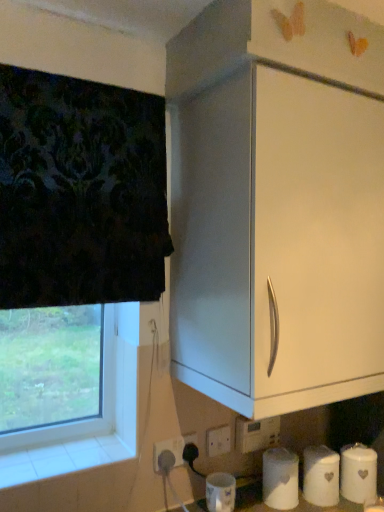
Describe the element at coordinates (169, 451) in the screenshot. I see `white plastic electric outlet at lower center, the 3th electric outlet when ordered from right to left` at that location.

The width and height of the screenshot is (384, 512). I want to click on white matte cabinet at upper right, so click(x=277, y=205).

How much space does white plastic electric outlet at lower center, the third electric outlet positioned from the left, occupy vertically?

3.48 inches.

What do you see at coordinates (190, 449) in the screenshot? The width and height of the screenshot is (384, 512). I see `white plastic electric outlet at lower center, the 2th electric outlet in the left-to-right sequence` at bounding box center [190, 449].

You are a GUI agent. You are given a task and a screenshot of the screen. Output one action in this format:
    pyautogui.click(x=<x>, y=<y>)
    Task: Click on the white matte toilet paper at lower center, the 1th toilet paper viewed from the left
    The width and height of the screenshot is (384, 512).
    Given the screenshot: What is the action you would take?
    pyautogui.click(x=280, y=479)

How many degrees apart are the facing directions of white matte paper towel at lower center and white plastic electric outlet at lower center, arranged as the 1th electric outlet when viewed from the right?

white matte paper towel at lower center and white plastic electric outlet at lower center, arranged as the 1th electric outlet when viewed from the right, are facing 1.15 degrees away from each other.

Considering the positions of objects white matte paper towel at lower center and white plastic electric outlet at lower center, arranged as the 1th electric outlet when viewed from the right, in the image provided, who is more to the left, white matte paper towel at lower center or white plastic electric outlet at lower center, arranged as the 1th electric outlet when viewed from the right,?

white matte paper towel at lower center.

Is point (230, 504) positioned behind point (218, 452)?

No, (230, 504) is closer to viewer.

From the picture: From their relative heights in the image, would you say white matte paper towel at lower center is taller or shorter than white plastic electric outlet at lower center, the third electric outlet positioned from the left?

In the image, white matte paper towel at lower center appears to be taller than white plastic electric outlet at lower center, the third electric outlet positioned from the left.

Does white plastic electric outlet at lower center, the 2th electric outlet in the left-to-right sequence, contain white plastic electric outlet at lower center, arranged as the 1th electric outlet when viewed from the right?

No, white plastic electric outlet at lower center, arranged as the 1th electric outlet when viewed from the right, is not a part of white plastic electric outlet at lower center, the 2th electric outlet in the left-to-right sequence.

Is white plastic electric outlet at lower center, the 2th electric outlet in the left-to-right sequence, facing away from white plastic electric outlet at lower center, the third electric outlet positioned from the left?

No, white plastic electric outlet at lower center, the 2th electric outlet in the left-to-right sequence, is not facing the opposite direction of white plastic electric outlet at lower center, the third electric outlet positioned from the left.

Considering the positions of objects white plastic electric outlet at lower center, the 2th electric outlet in the left-to-right sequence, and white plastic electric outlet at lower center, the third electric outlet positioned from the left, in the image provided, who is behind, white plastic electric outlet at lower center, the 2th electric outlet in the left-to-right sequence, or white plastic electric outlet at lower center, the third electric outlet positioned from the left,?

white plastic electric outlet at lower center, the third electric outlet positioned from the left, is more distant.

Considering the positions of points (211, 430) and (265, 504), is point (211, 430) farther from camera compared to point (265, 504)?

Yes, it is.

Between white plastic electric outlet at lower center, arranged as the 1th electric outlet when viewed from the right, and white matte toilet paper at lower center, the 1th toilet paper viewed from the left, which one has more height?

white matte toilet paper at lower center, the 1th toilet paper viewed from the left, is taller.

From a real-world perspective, which is physically above, white plastic electric outlet at lower center, arranged as the 1th electric outlet when viewed from the right, or white matte toilet paper at lower center, the 1th toilet paper viewed from the left?

white plastic electric outlet at lower center, arranged as the 1th electric outlet when viewed from the right, is physically above.

From the image's perspective, between white plastic electric outlet at lower center, arranged as the 1th electric outlet when viewed from the right, and white matte toilet paper at lower center, placed as the third toilet paper when sorted from right to left, who is located below?

white matte toilet paper at lower center, placed as the third toilet paper when sorted from right to left, appears lower in the image.

Is white ceramic canister at lower right, acting as the 1th toilet paper starting from the right, looking in the opposite direction of white matte toilet paper at lower center, placed as the third toilet paper when sorted from right to left?

No, white matte toilet paper at lower center, placed as the third toilet paper when sorted from right to left, is not at the back of white ceramic canister at lower right, acting as the 1th toilet paper starting from the right.

Based on the photo, can you confirm if white ceramic canister at lower right, acting as the 1th toilet paper starting from the right, is bigger than white matte toilet paper at lower center, the 1th toilet paper viewed from the left?

Actually, white ceramic canister at lower right, acting as the 1th toilet paper starting from the right, might be smaller than white matte toilet paper at lower center, the 1th toilet paper viewed from the left.

Is white ceramic canister at lower right, which is the third toilet paper from left to right, located outside white matte toilet paper at lower center, the 1th toilet paper viewed from the left?

Yes, white ceramic canister at lower right, which is the third toilet paper from left to right, is not within white matte toilet paper at lower center, the 1th toilet paper viewed from the left.

Is white matte paper towel at lower center behind white matte canister at lower right, marked as the second toilet paper in a right-to-left arrangement?

No, white matte paper towel at lower center is in front of white matte canister at lower right, marked as the second toilet paper in a right-to-left arrangement.

Does white matte paper towel at lower center have a lesser height compared to white matte canister at lower right, marked as the second toilet paper in a right-to-left arrangement?

Yes, white matte paper towel at lower center is shorter than white matte canister at lower right, marked as the second toilet paper in a right-to-left arrangement.

Looking at this image, in terms of width, does white matte paper towel at lower center look wider or thinner when compared to white matte canister at lower right, marked as the second toilet paper in a right-to-left arrangement?

white matte paper towel at lower center is wider than white matte canister at lower right, marked as the second toilet paper in a right-to-left arrangement.

Does point (235, 494) come behind point (321, 449)?

No, (235, 494) is closer to viewer.

In the scene shown: From a real-world perspective, which is physically above, white matte toilet paper at lower center, placed as the third toilet paper when sorted from right to left, or white plastic electric outlet at lower center, placed as the 1th electric outlet when sorted from left to right?

white plastic electric outlet at lower center, placed as the 1th electric outlet when sorted from left to right, from a real-world perspective.

Where is `the 1st toilet paper positioned below the white plastic electric outlet at lower center, the 3th electric outlet when ordered from right to left (from a real-world perspective)`? The height and width of the screenshot is (512, 384). the 1st toilet paper positioned below the white plastic electric outlet at lower center, the 3th electric outlet when ordered from right to left (from a real-world perspective) is located at coordinates (280, 479).

From the image's perspective, is white matte toilet paper at lower center, the 1th toilet paper viewed from the left, beneath white plastic electric outlet at lower center, the 3th electric outlet when ordered from right to left?

Indeed, from the image's perspective, white matte toilet paper at lower center, the 1th toilet paper viewed from the left, is shown beneath white plastic electric outlet at lower center, the 3th electric outlet when ordered from right to left.

Is white plastic electric outlet at lower center, placed as the 1th electric outlet when sorted from left to right, surrounded by white matte toilet paper at lower center, the 1th toilet paper viewed from the left?

No, white plastic electric outlet at lower center, placed as the 1th electric outlet when sorted from left to right, is not inside white matte toilet paper at lower center, the 1th toilet paper viewed from the left.

From a real-world perspective, is white plastic electric outlet at lower center, the 3th electric outlet when ordered from right to left, beneath white plastic electric outlet at lower center, the 2th electric outlet in the left-to-right sequence?

No, from a real-world perspective, white plastic electric outlet at lower center, the 3th electric outlet when ordered from right to left, is not below white plastic electric outlet at lower center, the 2th electric outlet in the left-to-right sequence.

Between white plastic electric outlet at lower center, the 3th electric outlet when ordered from right to left, and white plastic electric outlet at lower center, the 2th electric outlet in the left-to-right sequence, which one appears on the left side from the viewer's perspective?

Positioned to the left is white plastic electric outlet at lower center, the 3th electric outlet when ordered from right to left.

How many degrees apart are the facing directions of white plastic electric outlet at lower center, placed as the 1th electric outlet when sorted from left to right, and white plastic electric outlet at lower center, the 2th electric outlet in the left-to-right sequence?

The angular difference between white plastic electric outlet at lower center, placed as the 1th electric outlet when sorted from left to right, and white plastic electric outlet at lower center, the 2th electric outlet in the left-to-right sequence, is 0.739 degrees.

Find the location of `the 3rd electric outlet behind the white matte paper towel at lower center, starting your count from the anchor`. the 3rd electric outlet behind the white matte paper towel at lower center, starting your count from the anchor is located at coordinates tap(218, 441).

Locate an element on the screen. the 1st electric outlet counting from the left of the white plastic electric outlet at lower center, arranged as the 1th electric outlet when viewed from the right is located at coordinates (190, 449).

When comparing their distances from white plastic electric outlet at lower center, the 2th electric outlet in the right-to-left sequence, does white matte paper towel at lower center or white matte toilet paper at lower center, placed as the third toilet paper when sorted from right to left, seem further?

Among the two, white matte toilet paper at lower center, placed as the third toilet paper when sorted from right to left, is located further to white plastic electric outlet at lower center, the 2th electric outlet in the right-to-left sequence.

Based on their spatial positions, is white plastic electric outlet at lower center, the third electric outlet positioned from the left, or white matte toilet paper at lower center, placed as the third toilet paper when sorted from right to left, closer to white matte paper towel at lower center?

Among the two, white plastic electric outlet at lower center, the third electric outlet positioned from the left, is located nearer to white matte paper towel at lower center.

Considering their positions, is white plastic electric outlet at lower center, placed as the 1th electric outlet when sorted from left to right, positioned closer to white matte canister at lower right, marked as the second toilet paper in a right-to-left arrangement, than white ceramic canister at lower right, which is the third toilet paper from left to right?

white ceramic canister at lower right, which is the third toilet paper from left to right, is positioned closer to the anchor white matte canister at lower right, marked as the second toilet paper in a right-to-left arrangement.

Which object lies nearer to the anchor point white plastic electric outlet at lower center, the 2th electric outlet in the left-to-right sequence, white matte paper towel at lower center or white matte canister at lower right, marked as the second toilet paper in a right-to-left arrangement?

Based on the image, white matte paper towel at lower center appears to be nearer to white plastic electric outlet at lower center, the 2th electric outlet in the left-to-right sequence.

Considering their positions, is white matte paper towel at lower center positioned further to white matte cabinet at upper right than white plastic electric outlet at lower center, the 2th electric outlet in the right-to-left sequence?

white matte paper towel at lower center is further to white matte cabinet at upper right.

Considering their positions, is white matte canister at lower right, marked as the second toilet paper in a right-to-left arrangement, positioned closer to white matte toilet paper at lower center, the 1th toilet paper viewed from the left, than white matte paper towel at lower center?

white matte canister at lower right, marked as the second toilet paper in a right-to-left arrangement.

Consider the image. When comparing their distances from white matte cabinet at upper right, does transparent glass window at lower left or white plastic electric outlet at lower center, the 3th electric outlet when ordered from right to left, seem closer?

transparent glass window at lower left.

Based on their spatial positions, is white ceramic canister at lower right, which is the third toilet paper from left to right, or white plastic electric outlet at lower center, placed as the 1th electric outlet when sorted from left to right, closer to white matte cabinet at upper right?

white plastic electric outlet at lower center, placed as the 1th electric outlet when sorted from left to right.

At what (x,y) coordinates should I click in order to perform the action: click on electric outlet situated between white plastic electric outlet at lower center, placed as the 1th electric outlet when sorted from left to right, and white plastic electric outlet at lower center, the third electric outlet positioned from the left, from left to right. Please return your answer as a coordinate pair (x, y). Looking at the image, I should click on (190, 449).

The height and width of the screenshot is (512, 384). I want to click on electric outlet located between white plastic electric outlet at lower center, the 2th electric outlet in the right-to-left sequence, and white matte toilet paper at lower center, placed as the third toilet paper when sorted from right to left, in the left-right direction, so click(x=218, y=441).

Identify the location of paper towel between transparent glass window at lower left and white plastic electric outlet at lower center, the third electric outlet positioned from the left. The image size is (384, 512). (220, 492).

Where is `toilet paper between transparent glass window at lower left and white matte canister at lower right, marked as the second toilet paper in a right-to-left arrangement`? toilet paper between transparent glass window at lower left and white matte canister at lower right, marked as the second toilet paper in a right-to-left arrangement is located at coordinates (280, 479).